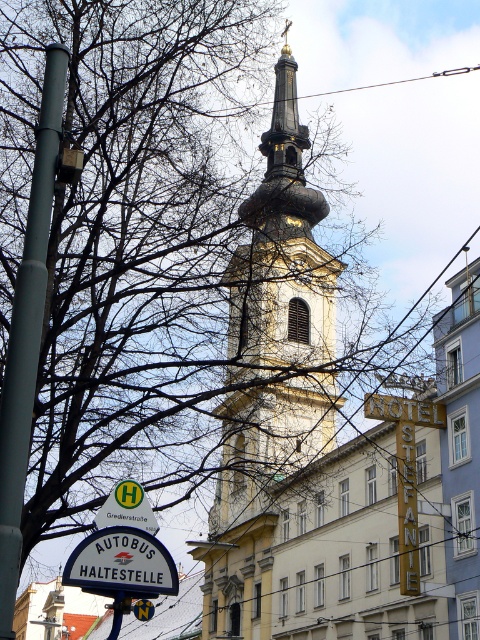
Question: Which of these objects is positioned closest to the golden stone church tower at center?

Choices:
 (A) yellow stone church at center
 (B) metallic wire at upper center
 (C) greenmaterial/texturesign at lower left

Answer: (A)

Question: Is golden stone church tower at center closer to the viewer compared to greenmaterial/texturesign at lower left?

Choices:
 (A) no
 (B) yes

Answer: (A)

Question: Which point appears closest to the camera in this image?

Choices:
 (A) (232, 604)
 (B) (134, 579)
 (C) (28, 372)

Answer: (C)

Question: Observing the image, what is the correct spatial positioning of white plastic sign at lower left in reference to metallic wire at upper center?

Choices:
 (A) above
 (B) below

Answer: (B)

Question: Which object appears closest to the camera in this image?

Choices:
 (A) golden stone church tower at center
 (B) metallic wire at upper center

Answer: (A)

Question: From the image, what is the correct spatial relationship of metallic gray pole at left in relation to greenmaterial/texturesign at lower left?

Choices:
 (A) below
 (B) above

Answer: (B)